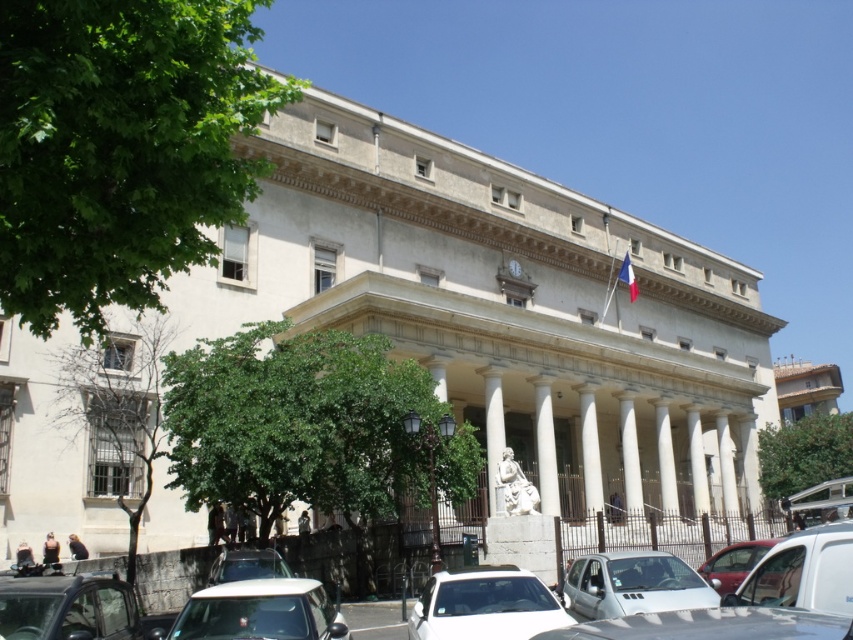
You are standing in front of the grand classical building and want to park your car. The parking spot you want to use is located at coordinate point 0.945, 0.569. Is the white glossy car at lower center currently occupying that spot?

Yes, the white glossy car at lower center is occupying the parking spot at coordinate point (485,604).

You are a parking attendant who needs to move the white glossy car at lower center and the metallic silver car at lower left. Which car requires more space to maneuver out of its current position?

The metallic silver car at lower left requires more space to maneuver out of its current position because it occupies more space than the white glossy car at lower center.

You are standing at the entrance of the grand classical building and want to park your car. The parking spot you want is at coordinate point 0.945, 0.569. Is the white glossy car at lower center currently occupying that spot?

The white glossy car at lower center is positioned at point (485, 604), so yes, it is occupying the parking spot you want.